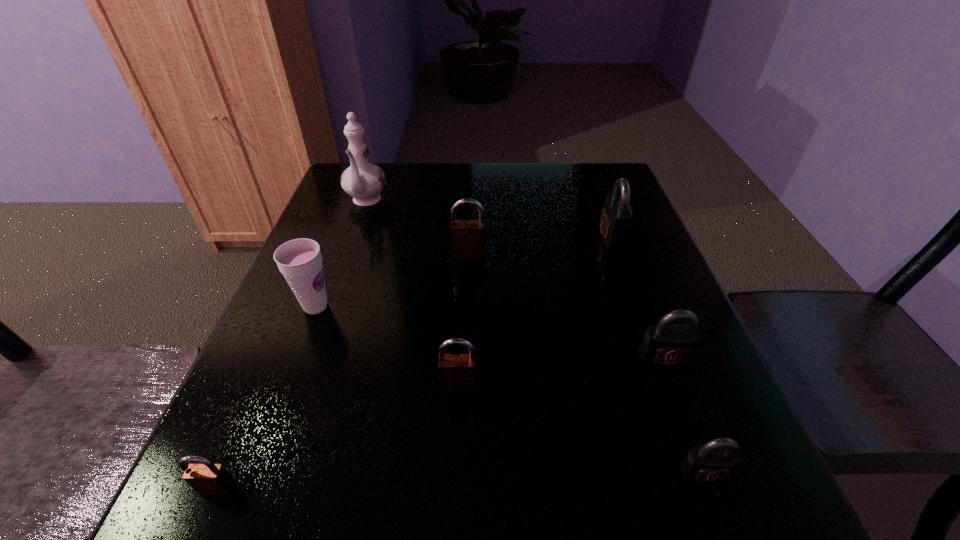
Locate an element on the screen. The width and height of the screenshot is (960, 540). vacant space at the far edge is located at coordinates (546, 165).

Identify the location of free space at the left edge of the desktop. This screenshot has height=540, width=960. (275, 318).

You are a GUI agent. You are given a task and a screenshot of the screen. Output one action in this format:
    pyautogui.click(x=<x>, y=<y>)
    Task: Click on the vacant region at the right edge of the desktop
    
    Given the screenshot: What is the action you would take?
    pyautogui.click(x=705, y=376)

Where is `free location at the near left corner of the desktop`? The width and height of the screenshot is (960, 540). free location at the near left corner of the desktop is located at coordinates (220, 534).

This screenshot has width=960, height=540. I want to click on vacant region at the far right corner of the desktop, so click(x=600, y=192).

In the image, there is a desktop. Where is `vacant space at the near right corner`? The height and width of the screenshot is (540, 960). vacant space at the near right corner is located at coordinates (759, 497).

Image resolution: width=960 pixels, height=540 pixels. Identify the location of free spot between the nearest gray padlock and the smallest brown padlock. (461, 480).

Locate an element on the screen. The height and width of the screenshot is (540, 960). free point between the fourth farthest object and the smallest gray padlock is located at coordinates (510, 389).

In order to click on free point between the biggest gray padlock and the second nearest brown padlock in this screenshot , I will do `click(535, 310)`.

At what (x,y) coordinates should I click in order to perform the action: click on vacant area that lies between the nearest gray padlock and the nearest brown padlock. Please return your answer as a coordinate pair (x, y). This screenshot has width=960, height=540. Looking at the image, I should click on (461, 480).